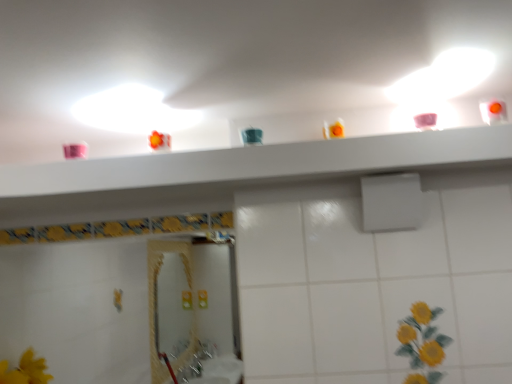
Question: In terms of width, does white glossy shelf at upper center look wider or thinner when compared to white matte shower at center?

Choices:
 (A) thin
 (B) wide

Answer: (B)

Question: Visually, is white glossy shelf at upper center positioned to the left or to the right of white matte shower at center?

Choices:
 (A) right
 (B) left

Answer: (B)

Question: From their relative heights in the image, would you say white glossy shelf at upper center is taller or shorter than white matte shower at center?

Choices:
 (A) short
 (B) tall

Answer: (A)

Question: From a real-world perspective, is white matte shower at center above or below white glossy shelf at upper center?

Choices:
 (A) above
 (B) below

Answer: (B)

Question: Considering the positions of white matte shower at center and white glossy shelf at upper center in the image, is white matte shower at center wider or thinner than white glossy shelf at upper center?

Choices:
 (A) thin
 (B) wide

Answer: (A)

Question: From the image's perspective, relative to white glossy shelf at upper center, is white matte shower at center above or below?

Choices:
 (A) below
 (B) above

Answer: (A)

Question: Considering the relative positions of white matte shower at center and white glossy shelf at upper center in the image provided, is white matte shower at center to the left or to the right of white glossy shelf at upper center?

Choices:
 (A) left
 (B) right

Answer: (B)